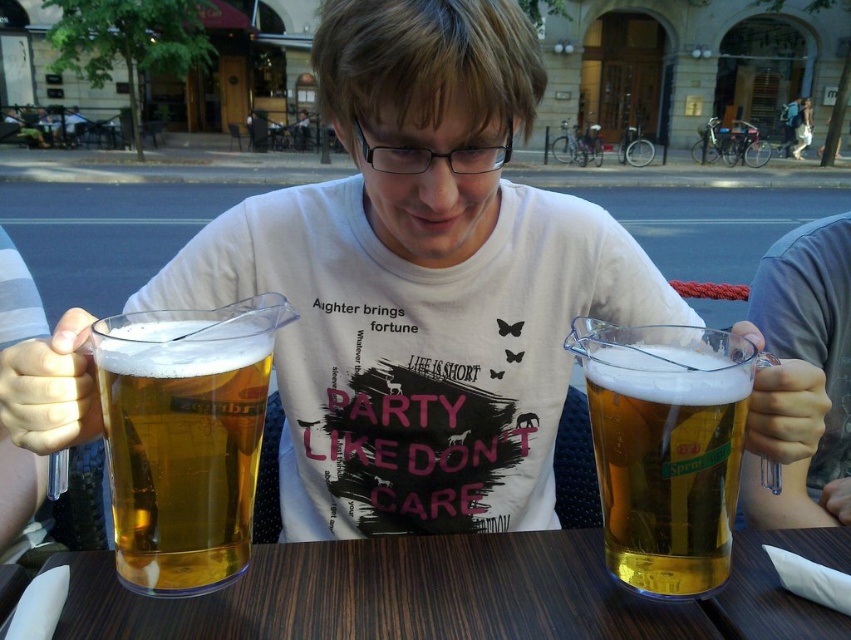
You are a customer at the outdoor cafe and want to place your phone on the wooden table at center. However, there is a translucent plastic mug at center in the way. Can you slide the mug to the side to make space?

The wooden table at center is further to the viewer than the translucent plastic mug at center, so the mug is closer to you. You can slide the translucent plastic mug at center to the side to make space for your phone.

You are a customer at the outdoor cafe and want to place your phone on the table. However, there is already a translucent plastic mug at center. Where should you place your phone so it doesn not fall off the wooden table at center?

The wooden table at center is positioned on the left side of the translucent plastic mug at center, so placing the phone on the left side of the mug would keep it on the table and prevent it from falling off.

You are a waiter at the outdoor cafe and need to place a new order of a small dessert plate on the table. The dessert plate is 15 cm in diameter. Can you fit it on the wooden table at center without overlapping the golden glass mug at left?

The wooden table at center is larger in size than golden glass mug at left, so yes, the dessert plate can be placed on the wooden table at center without overlapping the mug.